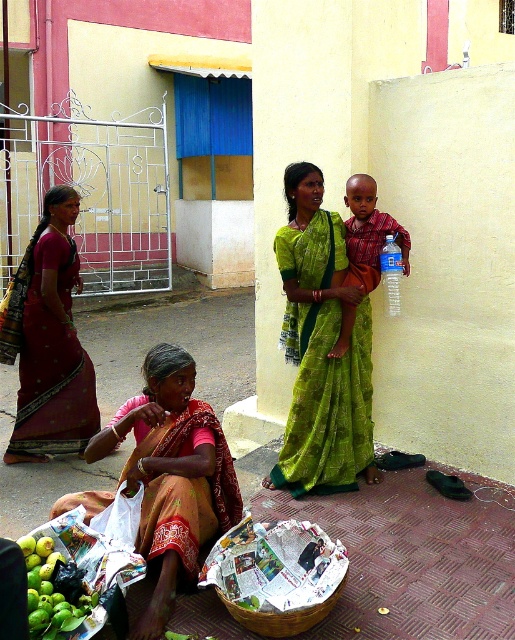
You are a delivery person trying to navigate through the courtyard. The path is the pink tile pavement at lower center. There is a matte red shirt at center blocking the path. Can you pass through without moving the person wearing the shirt?

The pink tile pavement at lower center is wider than the matte red shirt at center. Since the pavement is wider, you can pass through the path on either side of the matte red shirt at center without moving the person.

What is the exact coordinate of the green silk saree at center?

The green silk saree at center is located at the coordinate point of (320, 349).

You are a delivery person approaching the open metal gate with decorative patterns. You need to place a package on the pink tile pavement at lower center and the green silk saree at center. Which object is shorter and thus safer to place the package on?

The pink tile pavement at lower center is shorter than the green silk saree at center, so it is safer to place the package on the pink tile pavement at lower center to avoid damaging the saree.